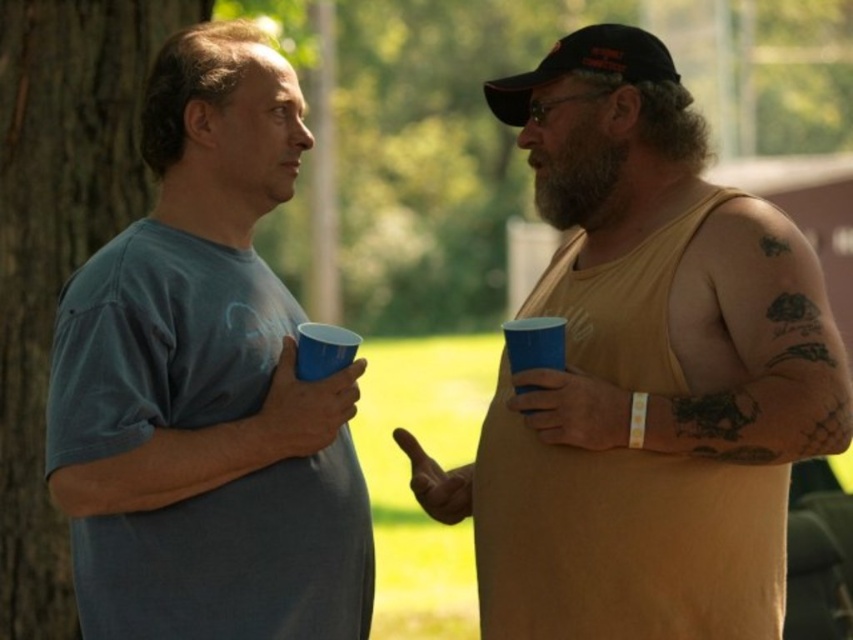
Question: Where is matte yellow tank top at right located in relation to blue plastic cup at right in the image?

Choices:
 (A) below
 (B) above

Answer: (A)

Question: Which object appears closest to the camera in this image?

Choices:
 (A) black fabric baseball cap at upper right
 (B) blue plastic cup at right
 (C) matte blue t-shirt at left
 (D) matte yellow tank top at right

Answer: (D)

Question: Which is farther from the matte yellow tank top at right?

Choices:
 (A) brown rough bark at left
 (B) matte blue t-shirt at left

Answer: (A)

Question: Is black fabric baseball cap at upper right bigger than blue plastic cup at right?

Choices:
 (A) no
 (B) yes

Answer: (B)

Question: Which object is the closest to the matte blue t-shirt at left?

Choices:
 (A) matte yellow tank top at right
 (B) black fabric baseball cap at upper right

Answer: (A)

Question: In this image, where is matte blue t-shirt at left located relative to blue plastic cup at right?

Choices:
 (A) below
 (B) above

Answer: (B)